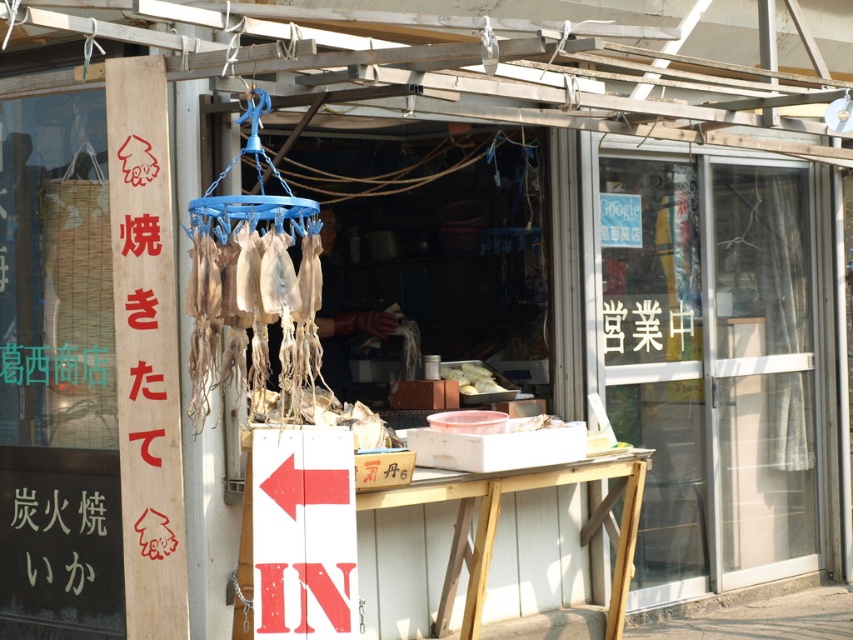
You are a customer at the food stall and want to read the red wooden sign at lower left while looking at the white matte food at center. Which one is easier to see because of its size?

The red wooden sign at lower left is bigger than the white matte food at center, so it is easier to see.